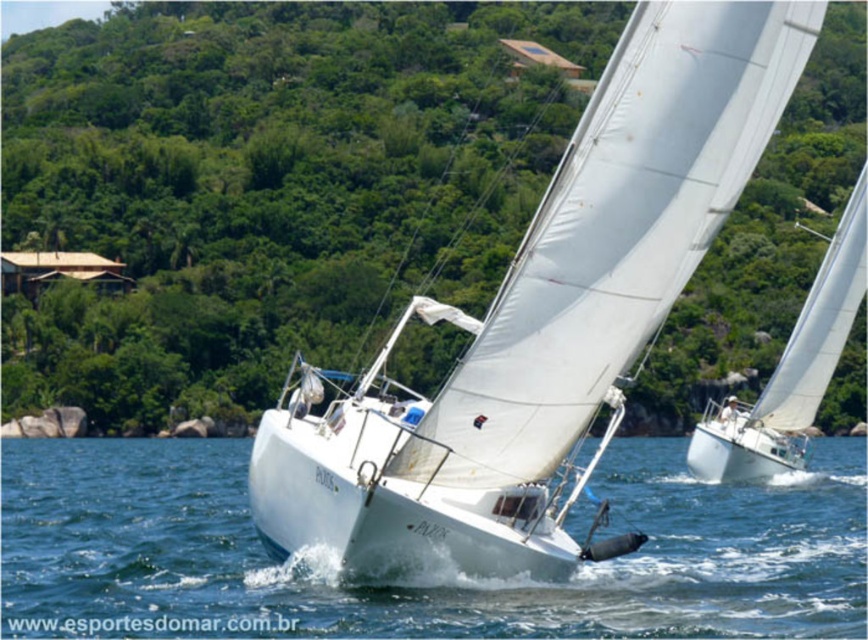
Question: Where is clear blue water at center located in relation to white matte sailboat at right in the image?

Choices:
 (A) above
 (B) below

Answer: (B)

Question: Does clear blue water at center appear on the left side of white matte sailboat at right?

Choices:
 (A) yes
 (B) no

Answer: (A)

Question: Which of these objects is positioned farthest from the white matte sailboat at right?

Choices:
 (A) white matte sailboat at center
 (B) clear blue water at center

Answer: (A)

Question: Which point is closer to the camera?

Choices:
 (A) (687, 540)
 (B) (770, 60)
 (C) (809, 296)

Answer: (B)

Question: Which point appears closest to the camera in this image?

Choices:
 (A) (30, 532)
 (B) (379, 413)

Answer: (B)

Question: Is clear blue water at center above white matte sailboat at right?

Choices:
 (A) yes
 (B) no

Answer: (B)